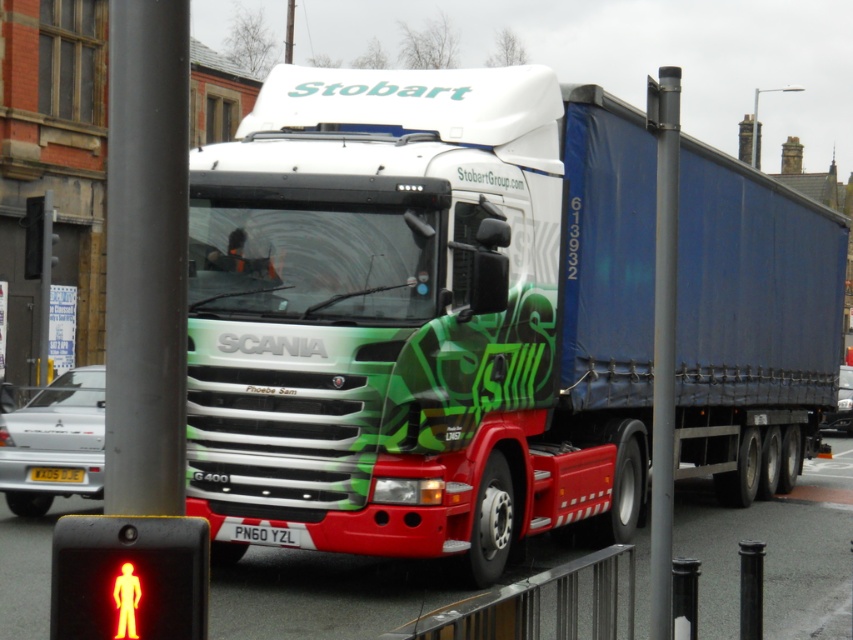
You are a pedestrian waiting at the crossing. You see a yellow plastic pedestrian at lower left and a yellow matte license plate at center. Which object is closer to your left side?

The yellow plastic pedestrian at lower left is to the right of the yellow matte license plate at center, so the license plate is closer to your left side.

You are standing in front of the Stobart Group Scania truck and want to place a small sticker on both the point at (x=582, y=86) and the point at (x=80, y=468). Which point will require you to reach closer to the truck?

The point at (x=582, y=86) is closer to the camera than the point at (x=80, y=468), so you will need to reach closer to the truck to place the sticker on the point at (x=80, y=468).